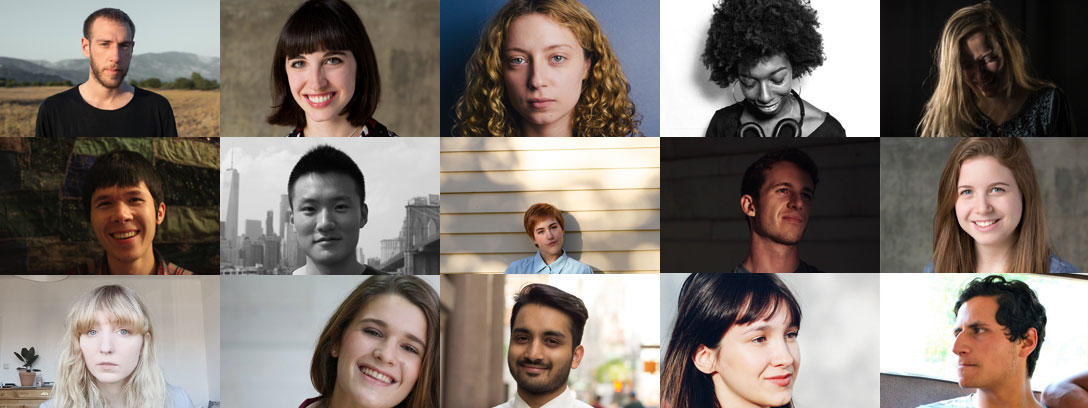
Identify the location of middle row of photos. (993, 197), (787, 202), (592, 210), (343, 216), (143, 200).